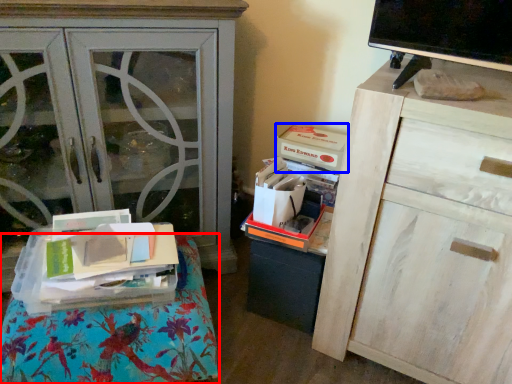
Question: Which object appears farthest to the camera in this image, furniture (highlighted by a red box) or storage box (highlighted by a blue box)?

Choices:
 (A) furniture
 (B) storage box

Answer: (B)